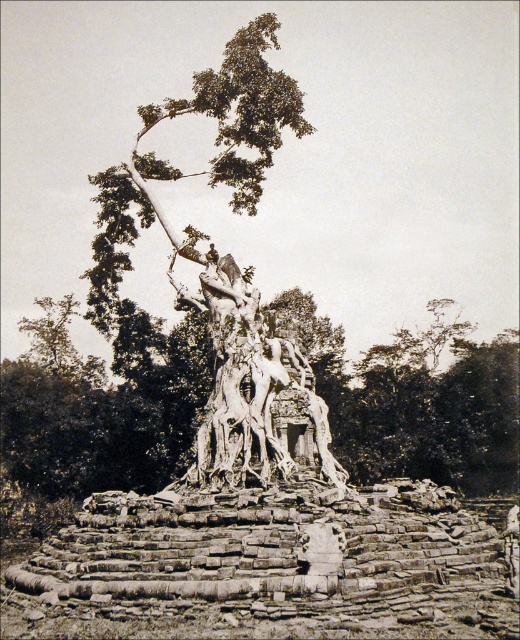
Question: Is rough bark tree trunk at center positioned at the back of white stone sculpture at center?

Choices:
 (A) yes
 (B) no

Answer: (A)

Question: Estimate the real-world distances between objects in this image. Which object is farther from the stone statue at center?

Choices:
 (A) rough bark tree trunk at center
 (B) white stone sculpture at center

Answer: (A)

Question: Can you confirm if stone statue at center is positioned to the left of white stone sculpture at center?

Choices:
 (A) no
 (B) yes

Answer: (B)

Question: In this image, where is rough bark tree trunk at center located relative to stone statue at center?

Choices:
 (A) left
 (B) right

Answer: (B)

Question: Which of the following is the closest to the observer?

Choices:
 (A) rough bark tree trunk at center
 (B) stone statue at center

Answer: (B)

Question: Which object is positioned closest to the white stone sculpture at center?

Choices:
 (A) rough bark tree trunk at center
 (B) stone statue at center

Answer: (B)